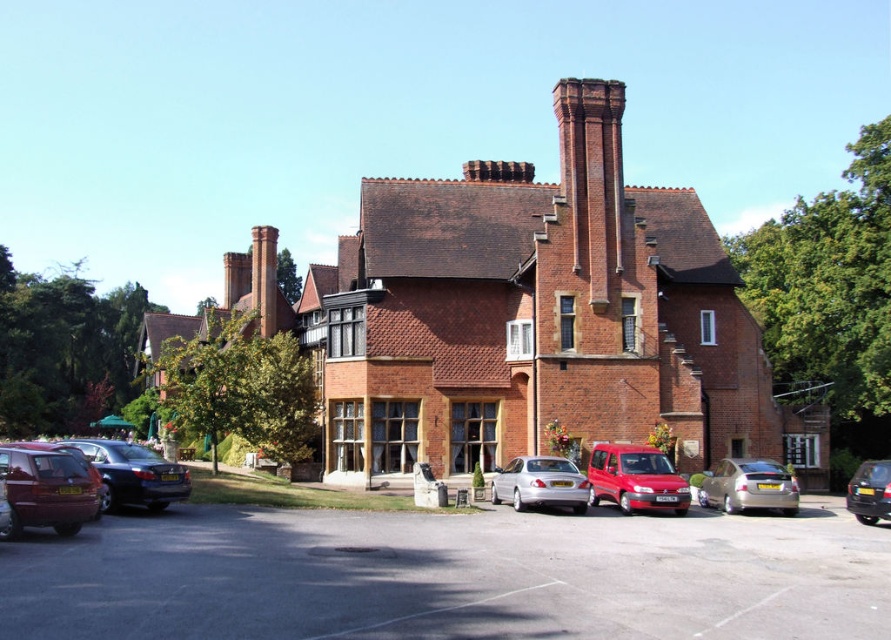
Question: Considering the relative positions of gray asphalt parking lot at lower center and silver metallic sedan at center in the image provided, where is gray asphalt parking lot at lower center located with respect to silver metallic sedan at center?

Choices:
 (A) above
 (B) below

Answer: (A)

Question: Observing the image, what is the correct spatial positioning of matte red van at center in reference to shiny black sedan at lower left?

Choices:
 (A) below
 (B) above

Answer: (A)

Question: Which object is positioned farthest from the shiny black sedan at lower left?

Choices:
 (A) silver metallic sedan at center
 (B) black glossy car at lower right
 (C) matte red van at center
 (D) maroon matte van at lower left

Answer: (B)

Question: Which of the following is the closest to the observer?

Choices:
 (A) maroon matte van at lower left
 (B) brick chimney at upper center
 (C) matte red van at center
 (D) gray asphalt parking lot at lower center

Answer: (D)

Question: Does gray asphalt parking lot at lower center have a lesser width compared to maroon matte van at lower left?

Choices:
 (A) yes
 (B) no

Answer: (B)

Question: Which of the following is the farthest from the observer?

Choices:
 (A) maroon matte van at lower left
 (B) silver metallic sedan at center
 (C) silver metallic sedan at lower right
 (D) gray asphalt parking lot at lower center

Answer: (C)